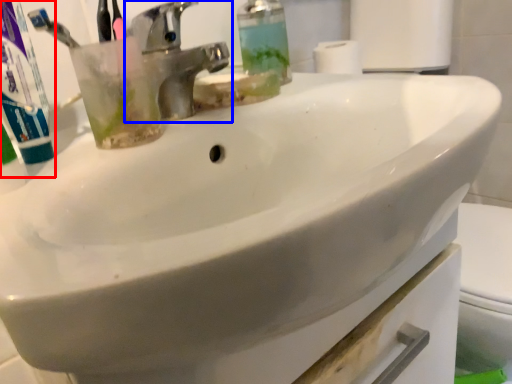
Question: Which of the following is the closest to the observer, toothpaste (highlighted by a red box) or tap (highlighted by a blue box)?

Choices:
 (A) toothpaste
 (B) tap

Answer: (A)